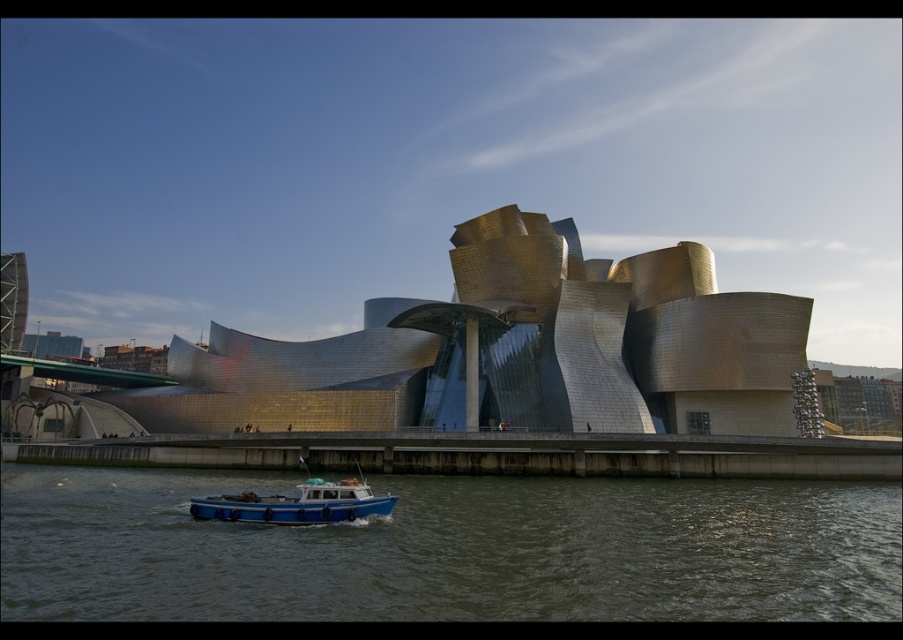
Based on the photo, does dark green water at lower center have a smaller size compared to blue matte boat at lower center?

No, dark green water at lower center is not smaller than blue matte boat at lower center.

Does dark green water at lower center come behind blue matte boat at lower center?

No, it is in front of blue matte boat at lower center.

At what (x,y) coordinates should I click in order to perform the action: click on dark green water at lower center. Please return your answer as a coordinate pair (x, y). Looking at the image, I should click on (452, 550).